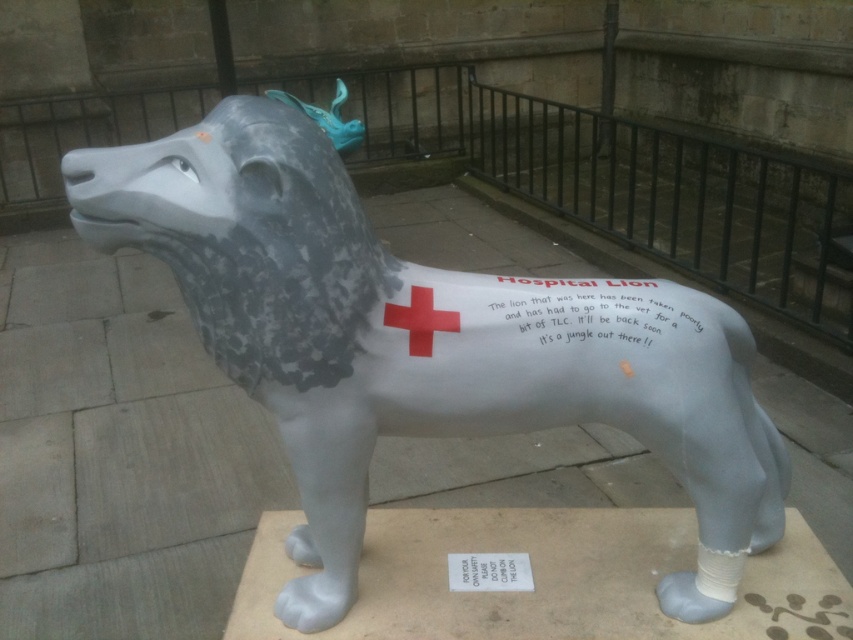
Which is in front, point (741, 492) or point (630, 307)?

Point (630, 307)

Is matte gray lion at center bigger than white paper at center?

Correct, matte gray lion at center is larger in size than white paper at center.

Between point (724, 612) and point (674, 317), which one is positioned in front?

Point (674, 317) is more forward.

At what (x,y) coordinates should I click in order to perform the action: click on matte gray lion at center. Please return your answer as a coordinate pair (x, y). Looking at the image, I should click on (410, 348).

Is matte gray lion at center below white paper at lower center?

No.

From the picture: Which is above, matte gray lion at center or white paper at lower center?

matte gray lion at center

Locate an element on the screen. matte gray lion at center is located at coordinates (410, 348).

Where is `white paper at center`? white paper at center is located at coordinates (593, 308).

Between white paper at center and white paper at lower center, which one has less height?

white paper at lower center

Is point (531, 330) closer to camera compared to point (468, 573)?

Yes, point (531, 330) is in front of point (468, 573).

The height and width of the screenshot is (640, 853). I want to click on white paper at center, so tap(593, 308).